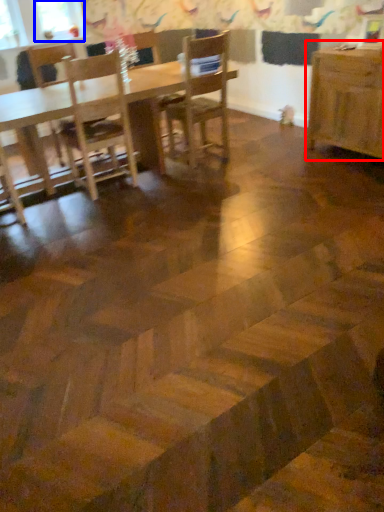
Question: Which object appears closest to the camera in this image, table (highlighted by a red box) or window screen (highlighted by a blue box)?

Choices:
 (A) table
 (B) window screen

Answer: (A)